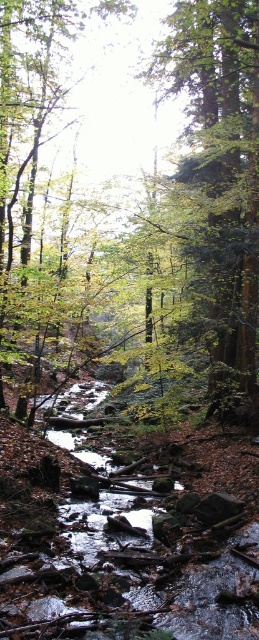
The height and width of the screenshot is (640, 259). What do you see at coordinates (203, 195) in the screenshot?
I see `green leafy tree at center` at bounding box center [203, 195].

Based on the photo, is green leafy tree at center to the left of green matte tree at center from the viewer's perspective?

Correct, you'll find green leafy tree at center to the left of green matte tree at center.

Is point (148, 294) closer to camera compared to point (238, 369)?

No, it is not.

At what (x,y) coordinates should I click in order to perform the action: click on green leafy tree at center. Please return your answer as a coordinate pair (x, y). Looking at the image, I should click on (203, 195).